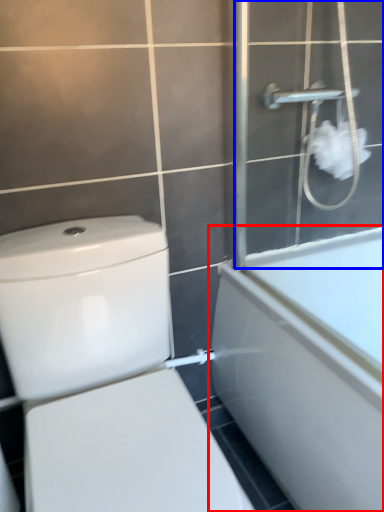
Question: Which point is closer to the camera, bathtub (highlighted by a red box) or screen door (highlighted by a blue box)?

Choices:
 (A) bathtub
 (B) screen door

Answer: (A)